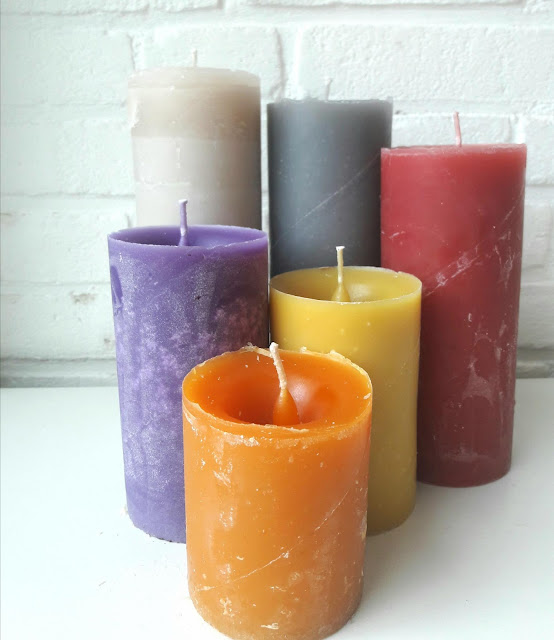
Find the location of a particular element. The width and height of the screenshot is (554, 640). candle is located at coordinates (497, 189), (311, 170), (220, 170), (160, 313), (331, 322), (312, 468).